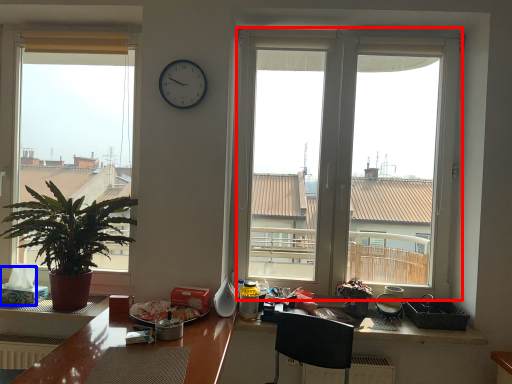
Question: Which of the following is the closest to the observer, window (highlighted by a red box) or tissue paper (highlighted by a blue box)?

Choices:
 (A) window
 (B) tissue paper

Answer: (B)